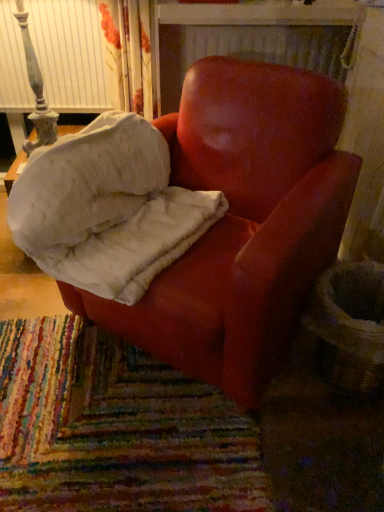
Question: Is point (276, 315) positioned closer to the camera than point (117, 129)?

Choices:
 (A) closer
 (B) farther

Answer: (A)

Question: From a real-world perspective, is matte red armchair at center physically located above or below velvet red armchair at center?

Choices:
 (A) above
 (B) below

Answer: (B)

Question: Is matte red armchair at center taller or shorter than velvet red armchair at center?

Choices:
 (A) short
 (B) tall

Answer: (B)

Question: From a real-world perspective, is velvet red armchair at center above or below matte red armchair at center?

Choices:
 (A) below
 (B) above

Answer: (B)

Question: Is velvet red armchair at center in front of or behind matte red armchair at center in the image?

Choices:
 (A) front
 (B) behind

Answer: (B)

Question: Considering the relative positions of velvet red armchair at center and matte red armchair at center in the image provided, is velvet red armchair at center to the left or to the right of matte red armchair at center?

Choices:
 (A) left
 (B) right

Answer: (A)

Question: Is velvet red armchair at center wider or thinner than matte red armchair at center?

Choices:
 (A) thin
 (B) wide

Answer: (A)